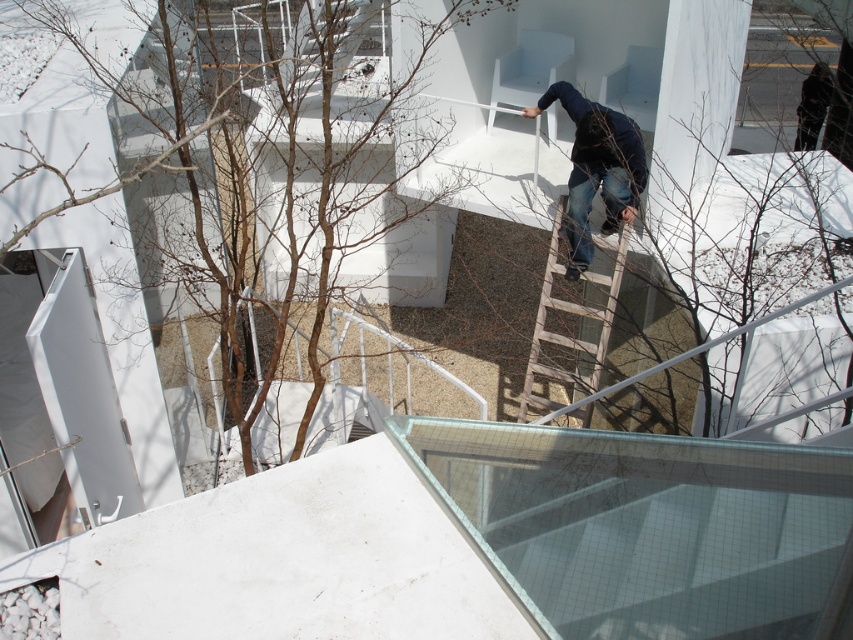
You are standing at the base of the architectural structure and want to reach the point closer to the camera. Which point should you head towards, point [554,353] or point [577,118]?

You should head towards point [554,353] because it is further to the camera than point [577,118], meaning it is closer to your current position at the base.